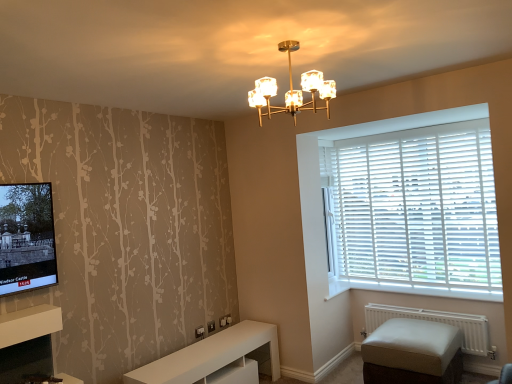
Where is `blank space above white glossy cabinet at lower center (from a real-world perspective)`? blank space above white glossy cabinet at lower center (from a real-world perspective) is located at coordinates (212, 343).